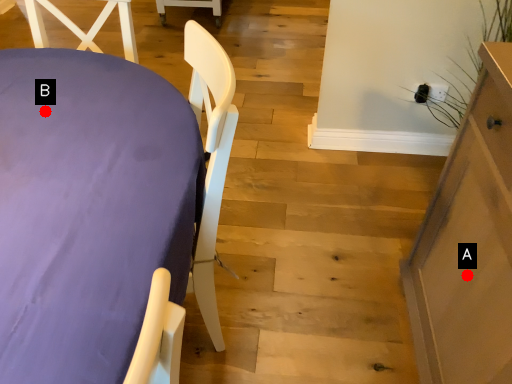
Question: Two points are circled on the image, labeled by A and B beside each circle. Among these points, which one is nearest to the camera?

Choices:
 (A) A is closer
 (B) B is closer

Answer: (A)